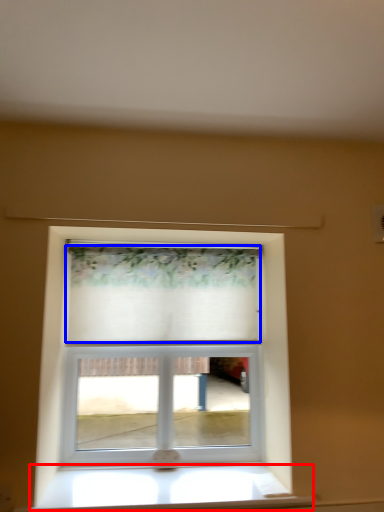
Question: Which object is further to the camera taking this photo, window sill (highlighted by a red box) or curtain (highlighted by a blue box)?

Choices:
 (A) window sill
 (B) curtain

Answer: (B)